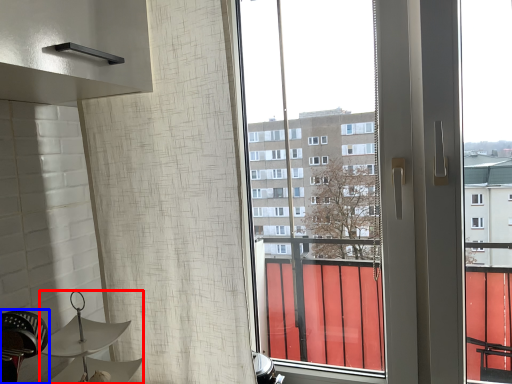
Question: Which point is closer to the camera, lamp (highlighted by a red box) or swivel chair (highlighted by a blue box)?

Choices:
 (A) lamp
 (B) swivel chair

Answer: (B)